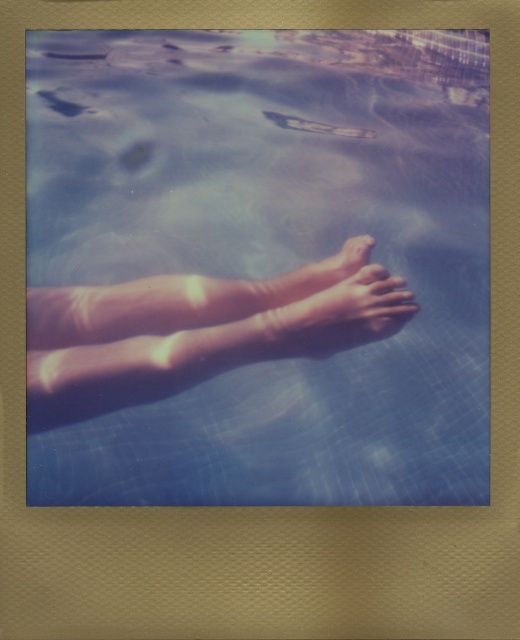
Question: Which point is farther to the camera?

Choices:
 (A) tap(154, 433)
 (B) tap(275, 300)
 (C) tap(296, 333)

Answer: (A)

Question: Which point is closer to the camera?

Choices:
 (A) (214, 324)
 (B) (267, 344)

Answer: (B)

Question: Is transparent blue water at center positioned behind smooth skin feet at center?

Choices:
 (A) yes
 (B) no

Answer: (A)

Question: Does transparent blue water at center have a larger size compared to smooth skin feet at center?

Choices:
 (A) yes
 (B) no

Answer: (A)

Question: Which of the following is the farthest from the observer?

Choices:
 (A) (400, 323)
 (B) (277, 292)

Answer: (B)

Question: Can you confirm if transparent blue water at center is positioned to the right of smooth skin feet at center?

Choices:
 (A) no
 (B) yes

Answer: (A)